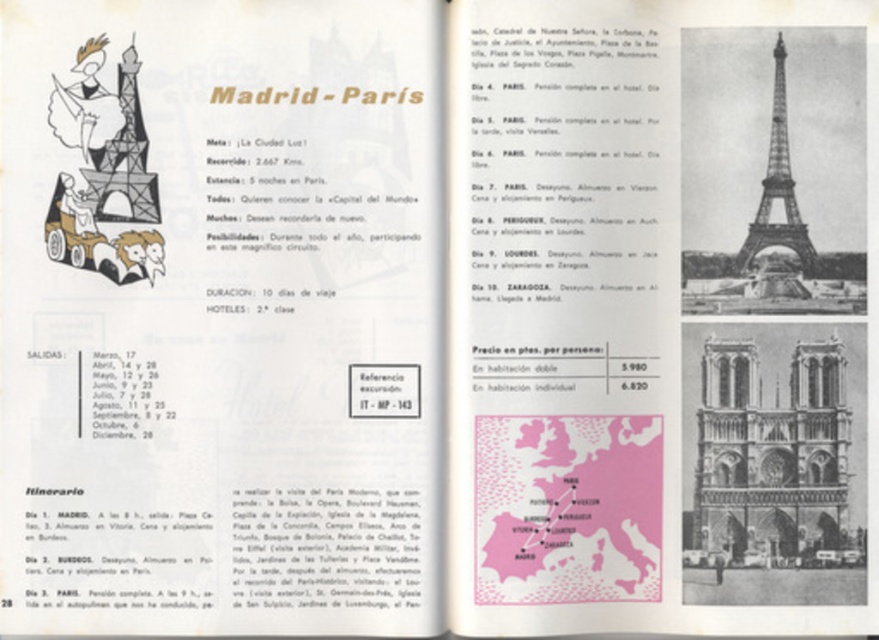
Does stone gothic cathedral at lower right appear over metallic silver eiffel tower at upper right?

Actually, stone gothic cathedral at lower right is below metallic silver eiffel tower at upper right.

Can you confirm if stone gothic cathedral at lower right is shorter than metallic silver eiffel tower at upper right?

Indeed, stone gothic cathedral at lower right has a lesser height compared to metallic silver eiffel tower at upper right.

Is point (837, 401) closer to camera compared to point (783, 100)?

No.

Find the location of a particular element. The image size is (879, 640). stone gothic cathedral at lower right is located at coordinates (772, 460).